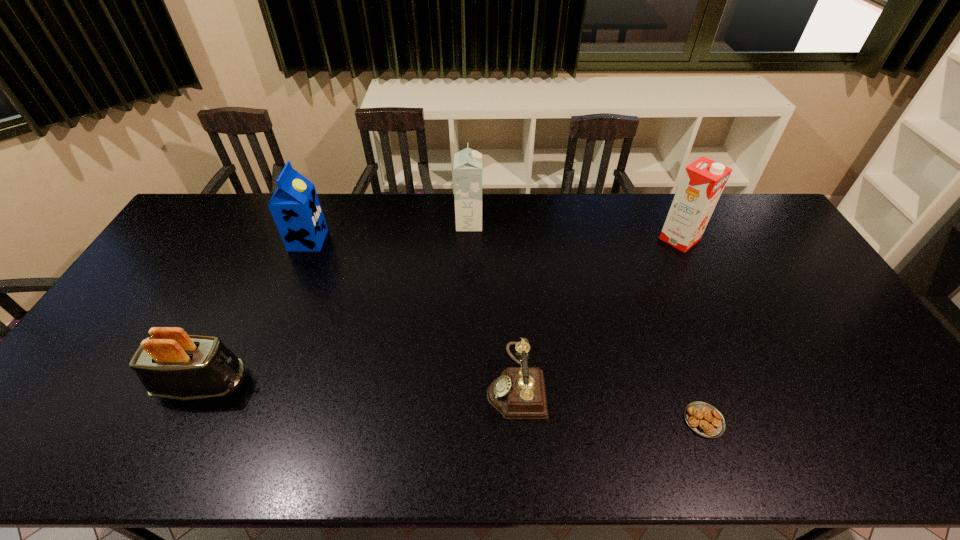
The height and width of the screenshot is (540, 960). In order to click on the rightmost object in this screenshot , I will do `click(702, 182)`.

You are a GUI agent. You are given a task and a screenshot of the screen. Output one action in this format:
    pyautogui.click(x=<x>, y=<y>)
    Task: Click on the second carton from left to right
    
    Given the screenshot: What is the action you would take?
    pyautogui.click(x=467, y=168)

At what (x,y) coordinates should I click in order to perform the action: click on the leftmost carton. Please return your answer as a coordinate pair (x, y). Looking at the image, I should click on (295, 207).

I want to click on the fourth tallest object, so pos(171,364).

This screenshot has height=540, width=960. Identify the location of the second shortest object. (519, 392).

Where is `telephone`? Image resolution: width=960 pixels, height=540 pixels. telephone is located at coordinates (519, 392).

Find the location of a particular element. pastry is located at coordinates point(704,419).

Identify the location of the shortest object. The height and width of the screenshot is (540, 960). (x=704, y=419).

Find the location of a particular element. This screenshot has width=960, height=540. vacant space located 0.250m on the left of the rightmost carton is located at coordinates click(x=587, y=239).

At what (x,y) coordinates should I click in order to perform the action: click on vacant space situated 0.350m on the front label of the second carton from right to left. Please return your answer as a coordinate pair (x, y). The height and width of the screenshot is (540, 960). Looking at the image, I should click on (580, 224).